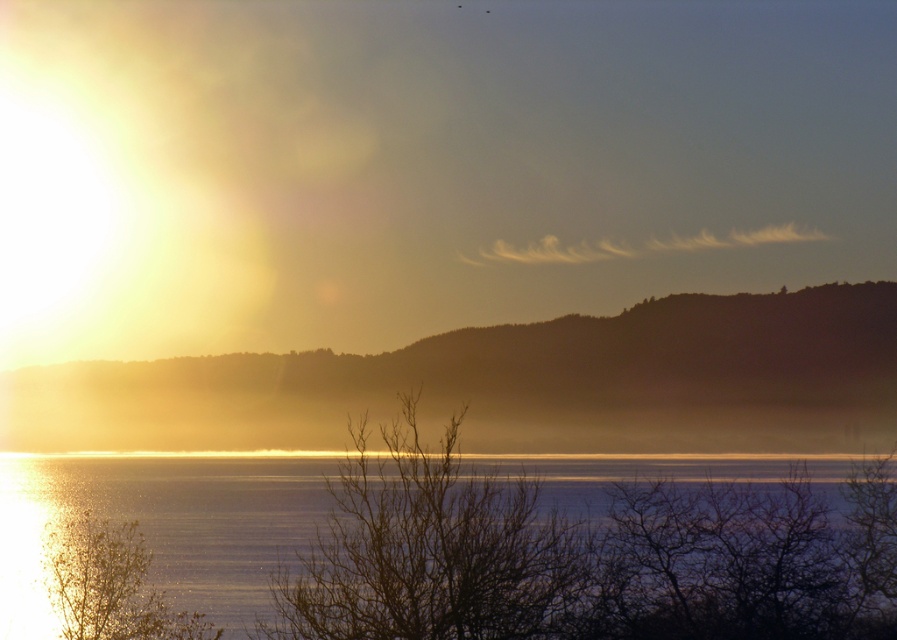
Find the location of a particular element. This screenshot has height=640, width=897. glistening water at lower center is located at coordinates (442, 554).

Which of these two, glistening water at lower center or green matte tree at lower left, stands shorter?

Standing shorter between the two is green matte tree at lower left.

Who is more distant from viewer, (x=251, y=545) or (x=161, y=605)?

Positioned behind is point (x=251, y=545).

Identify the location of glistening water at lower center. (442, 554).

Does foggy horizon at center have a greater height compared to brown/dry branches at center?

Yes.

Can you confirm if foggy horizon at center is positioned to the left of brown/dry branches at center?

Indeed, foggy horizon at center is positioned on the left side of brown/dry branches at center.

Who is more forward, (538,349) or (356,468)?

Point (356,468)

Find the location of a particular element. The width and height of the screenshot is (897, 640). foggy horizon at center is located at coordinates (514, 385).

Is glistening water at lower center to the right of brown/dry branches at center from the viewer's perspective?

Incorrect, glistening water at lower center is not on the right side of brown/dry branches at center.

Who is more forward, (110,589) or (396,426)?

Point (396,426)

Locate an element on the screen. The height and width of the screenshot is (640, 897). glistening water at lower center is located at coordinates (442, 554).